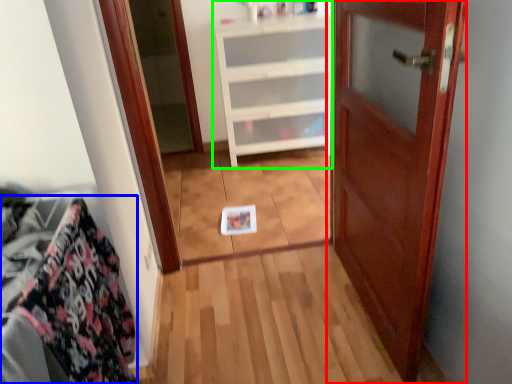
Question: Considering the real-world distances, which object is farthest from door (highlighted by a red box)? material (highlighted by a blue box) or cabinetry (highlighted by a green box)?

Choices:
 (A) material
 (B) cabinetry

Answer: (B)